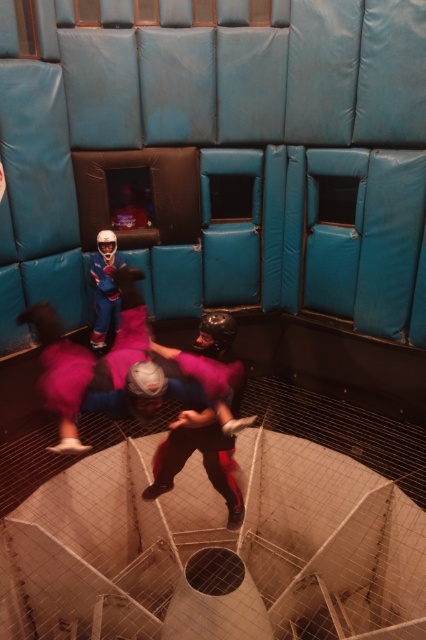
Does pink fabric helmet at center lie in front of matte blue suit at center?

That is True.

Consider the image. Is pink fabric helmet at center shorter than matte blue suit at center?

No.

Find the location of a particular element. The width and height of the screenshot is (426, 640). pink fabric helmet at center is located at coordinates (204, 417).